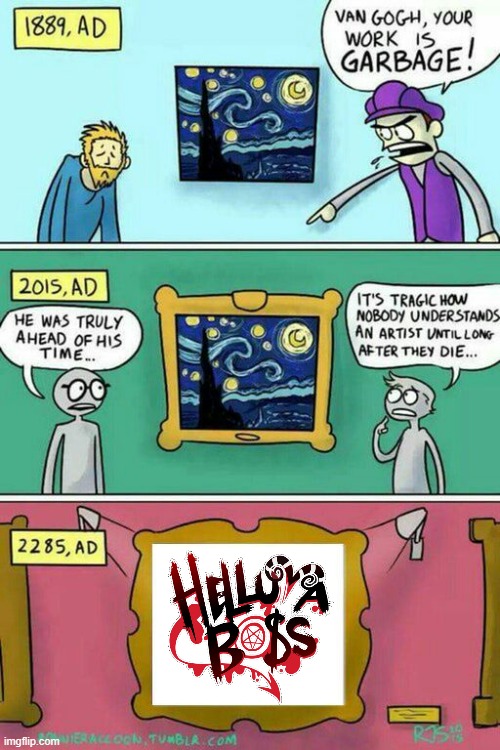
The image size is (500, 750). I want to click on starry night artwork, so click(247, 144), click(265, 361).